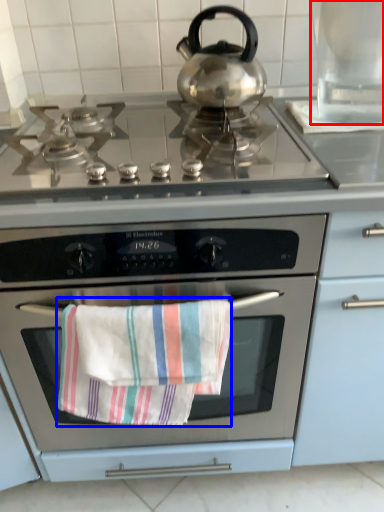
Question: Which object is closer to the camera taking this photo, appliance (highlighted by a red box) or beach towel (highlighted by a blue box)?

Choices:
 (A) appliance
 (B) beach towel

Answer: (B)